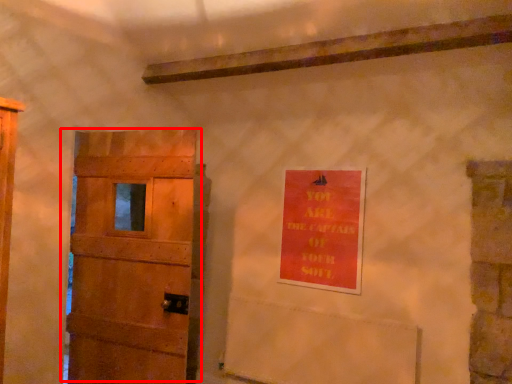
Question: Where is door (annotated by the red box) located in relation to warning sign in the image?

Choices:
 (A) left
 (B) right

Answer: (A)